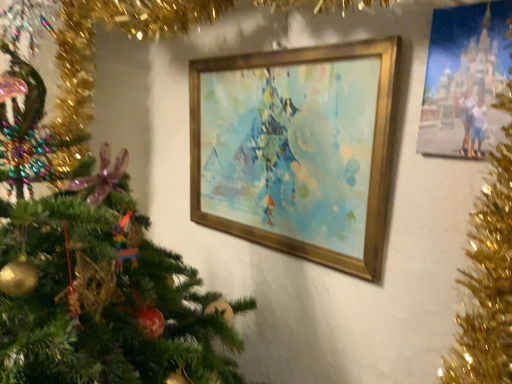
Question: From the image's perspective, is gold metallic picture frame at center, which is the first picture frame in back-to-front order, positioned above or below matte plastic photo frame at upper right, acting as the 1th picture frame starting from the front?

Choices:
 (A) below
 (B) above

Answer: (A)

Question: From a real-world perspective, is gold metallic picture frame at center, which is the first picture frame in back-to-front order, positioned above or below matte plastic photo frame at upper right, the second picture frame in the left-to-right sequence?

Choices:
 (A) above
 (B) below

Answer: (B)

Question: In the image, is gold metallic picture frame at center, which is the first picture frame in back-to-front order, positioned in front of or behind matte plastic photo frame at upper right, acting as the 1th picture frame starting from the front?

Choices:
 (A) front
 (B) behind

Answer: (B)

Question: In terms of size, does matte plastic photo frame at upper right, the second picture frame in the left-to-right sequence, appear bigger or smaller than gold metallic picture frame at center, the second picture frame positioned from the right?

Choices:
 (A) small
 (B) big

Answer: (A)

Question: Considering the relative positions of matte plastic photo frame at upper right, which appears as the 2th picture frame when viewed from the back, and gold metallic picture frame at center, which is the first picture frame in back-to-front order, in the image provided, is matte plastic photo frame at upper right, which appears as the 2th picture frame when viewed from the back, to the left or to the right of gold metallic picture frame at center, which is the first picture frame in back-to-front order,?

Choices:
 (A) left
 (B) right

Answer: (B)

Question: From the image's perspective, relative to gold metallic picture frame at center, which is the first picture frame in back-to-front order, is matte plastic photo frame at upper right, acting as the 1th picture frame starting from the front, above or below?

Choices:
 (A) above
 (B) below

Answer: (A)

Question: From their relative heights in the image, would you say matte plastic photo frame at upper right, the second picture frame in the left-to-right sequence, is taller or shorter than gold metallic picture frame at center, the second picture frame positioned from the right?

Choices:
 (A) tall
 (B) short

Answer: (B)